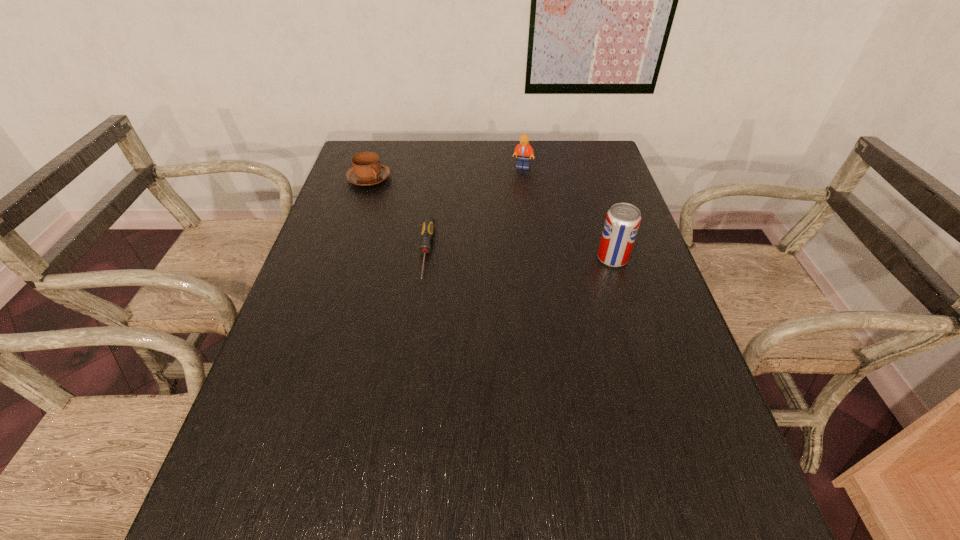
Where is `vacant space that satisfies the following two spatial constraints: 1. on the back side of the third tallest object; 2. on the left side of the Lego`? This screenshot has width=960, height=540. vacant space that satisfies the following two spatial constraints: 1. on the back side of the third tallest object; 2. on the left side of the Lego is located at coordinates (372, 167).

Image resolution: width=960 pixels, height=540 pixels. I want to click on vacant space that satisfies the following two spatial constraints: 1. on the front side of the tallest object; 2. on the left side of the Lego, so click(x=535, y=258).